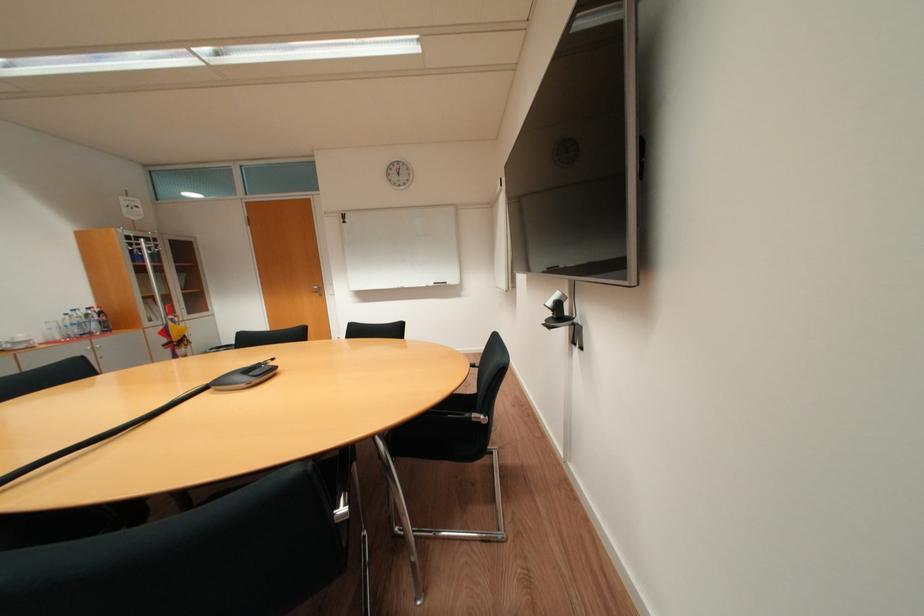
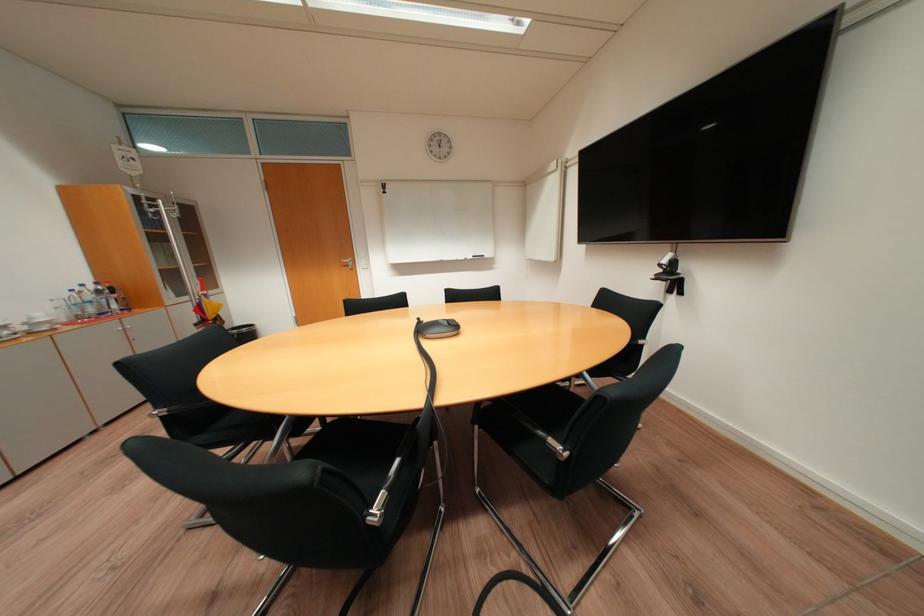
Where in the second image is the point corresponding to (558,304) from the first image?

(673, 262)